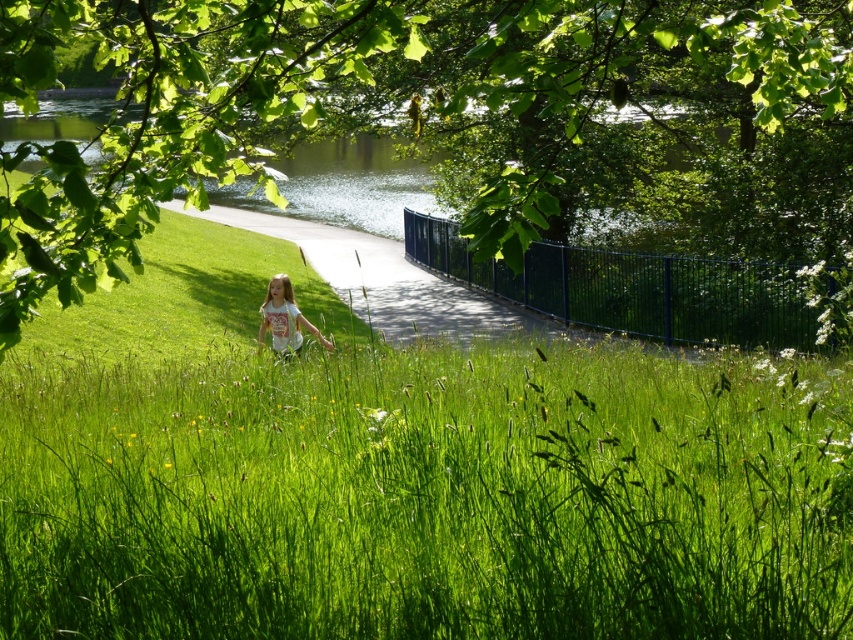
You are standing at the point with coordinates point (294, 337) and want to walk to the point with coordinates point (115, 442). Which direction should you move in relation to the girl walking on the path?

You should move in the direction towards the girl walking on the path because point (115, 442) is in front of point (294, 337), meaning it is closer to the girl.

You are a gardener planning to plant a new row of flowers between the green grassy at center and the green leafy tree at upper center. Given that the grassy area is narrower than the tree, which area should you choose to ensure the flowers have more space to grow?

The green leafy tree at upper center has a greater width than the green grassy at center, so planting the flowers near the green leafy tree at upper center would provide more space for growth.

You are a photographer planning to capture the green grassy at center and the green leafy tree at upper center in a single shot. Based on their positions, which object should you focus on first to ensure both are in frame?

The green leafy tree at upper center should be focused on first because the green grassy at center is positioned to its right, meaning the tree is closer to the left side of the frame. By starting with the tree, you can adjust the camera to include both objects in the shot.